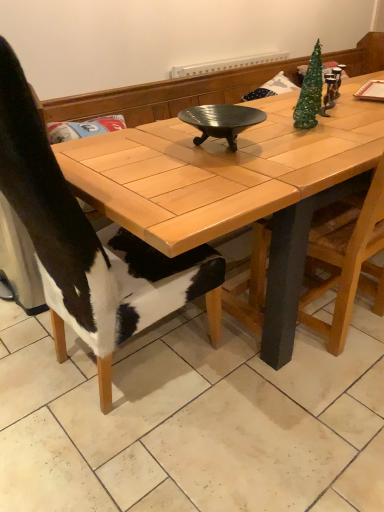
Question: Is wooden chair at right, the 1th chair in the right-to-left sequence, taller or shorter than cowhide at left, marked as the 2th chair in a right-to-left arrangement?

Choices:
 (A) short
 (B) tall

Answer: (A)

Question: Is wooden chair at right, which ranks as the second chair in left-to-right order, bigger or smaller than cowhide at left, which ranks as the first chair in left-to-right order?

Choices:
 (A) big
 (B) small

Answer: (B)

Question: Estimate the real-world distances between objects in this image. Which object is farther from the black ribbed metal wok at center?

Choices:
 (A) wooden table at center
 (B) cowhide at left, marked as the 2th chair in a right-to-left arrangement
 (C) wooden chair at right, which ranks as the second chair in left-to-right order

Answer: (B)

Question: Estimate the real-world distances between objects in this image. Which object is farther from the black ribbed metal wok at center?

Choices:
 (A) cowhide at left, which ranks as the first chair in left-to-right order
 (B) wooden chair at right, which ranks as the second chair in left-to-right order
 (C) wooden table at center

Answer: (A)